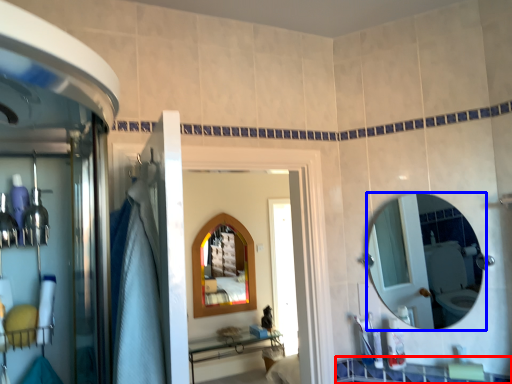
Question: Which object appears farthest to the camera in this image, counter top (highlighted by a red box) or mirror (highlighted by a blue box)?

Choices:
 (A) counter top
 (B) mirror

Answer: (B)